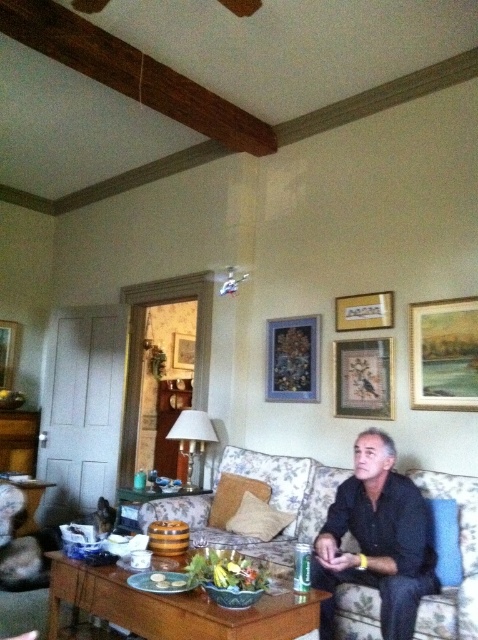
How much distance is there between woodenwoodentable at center and wooden picture frame at left?

woodenwoodentable at center and wooden picture frame at left are 2.73 meters apart.

Does woodenwoodentable at center appear on the left side of wooden picture frame at left?

No, woodenwoodentable at center is not to the left of wooden picture frame at left.

Does point (145, 528) come behind point (6, 342)?

That is False.

Identify the location of woodenwoodentable at center. (160, 508).

Which is more to the right, wooden framed artwork at upper center or wooden picture frame at center?

wooden framed artwork at upper center

In the scene shown: Between wooden framed artwork at upper center and wooden picture frame at center, which one has less height?

wooden picture frame at center is shorter.

Find the location of a particular element. wooden framed artwork at upper center is located at coordinates (364, 378).

In the scene shown: Measure the distance between woodenmaterial/texturetable at lower center and woodenwoodentable at center.

woodenmaterial/texturetable at lower center is 3.62 feet from woodenwoodentable at center.

Between woodenmaterial/texturetable at lower center and woodenwoodentable at center, which one appears on the right side from the viewer's perspective?

From the viewer's perspective, woodenmaterial/texturetable at lower center appears more on the right side.

Who is more distant from viewer, (x=260, y=600) or (x=182, y=504)?

Point (x=182, y=504)

At what (x,y) coordinates should I click in order to perform the action: click on woodenmaterial/texturetable at lower center. Please return your answer as a coordinate pair (x, y). Looking at the image, I should click on (173, 608).